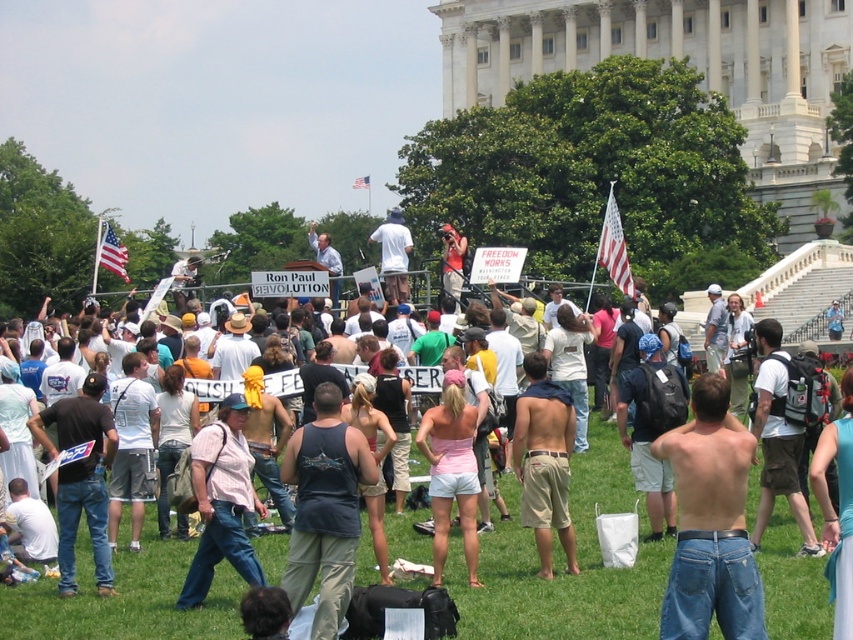
You are a photographer trying to capture a candid shot of the crowd at this event. You notice the white cotton shirt at center and the blue jeans at center. Which clothing item would block your view more if they are side by side in the frame?

The white cotton shirt at center might block your view more than the blue jeans at center since it is wider according to the description.

From the picture: You are a photographer trying to capture a photo of the American flag at upper right without including the tan shorts at center in the frame. Based on their positions, is this possible? Explain your reasoning.

The tan shorts at center is to the left of the american flag at upper right, so if you position yourself to the left side of the flag, you can frame the shot to exclude the shorts.